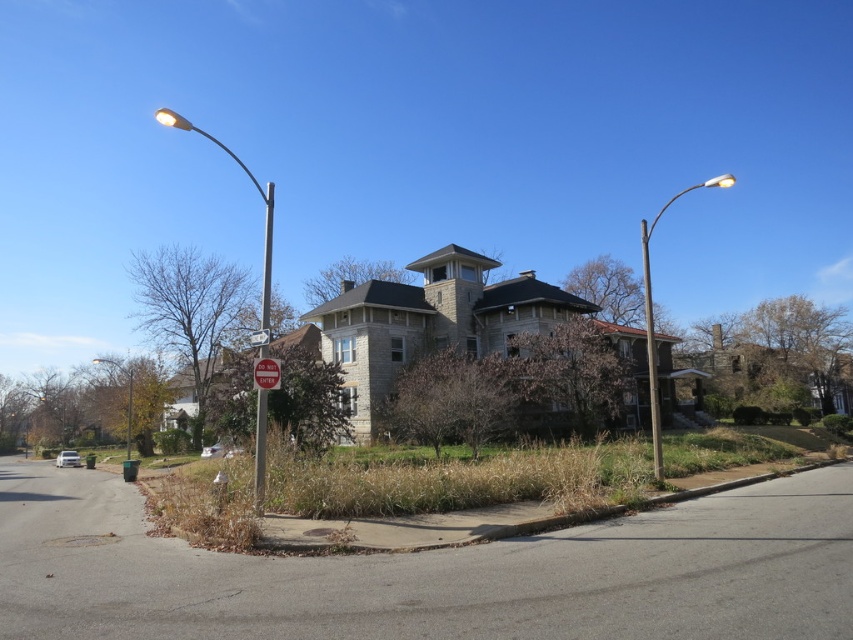
Who is more distant from viewer, (651,392) or (645,264)?

Positioned behind is point (645,264).

Who is shorter, metallic silver streetlight at right or metallic pole at right?

metallic pole at right

Is point (654, 400) positioned behind point (650, 332)?

That is False.

This screenshot has height=640, width=853. Identify the location of metallic silver streetlight at right. (653, 317).

Does metallic pole at right appear under metallic pole at lower left?

No, metallic pole at right is not below metallic pole at lower left.

Who is more forward, (x=660, y=211) or (x=96, y=356)?

Positioned in front is point (x=660, y=211).

Consider the image. Who is more forward, (646, 337) or (126, 408)?

Point (646, 337)

Identify the location of metallic pole at right. The width and height of the screenshot is (853, 640). (651, 353).

Which of these two, metallic pole at lower left or white plastic sign at center, stands taller?

Standing taller between the two is metallic pole at lower left.

This screenshot has width=853, height=640. Find the location of `metallic pole at lower left`. metallic pole at lower left is located at coordinates (126, 396).

Is point (129, 444) positioned after point (257, 342)?

Yes, point (129, 444) is farther from viewer.

Locate an element on the screen. metallic pole at lower left is located at coordinates (126, 396).